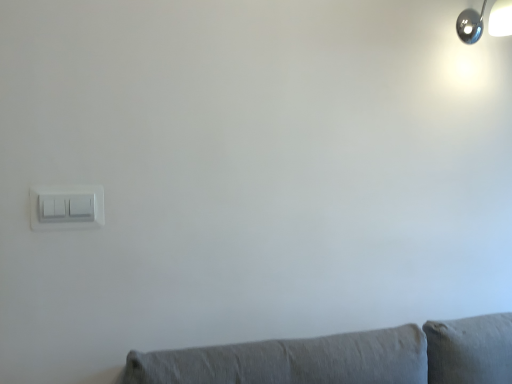
Question: From a real-world perspective, is white plastic light switch at left physically located above or below polished chrome lamp at upper right?

Choices:
 (A) below
 (B) above

Answer: (A)

Question: In terms of size, does white plastic light switch at left appear bigger or smaller than polished chrome lamp at upper right?

Choices:
 (A) big
 (B) small

Answer: (B)

Question: From the image's perspective, is white plastic light switch at left above or below polished chrome lamp at upper right?

Choices:
 (A) below
 (B) above

Answer: (A)

Question: From the image's perspective, relative to white plastic light switch at left, is polished chrome lamp at upper right above or below?

Choices:
 (A) above
 (B) below

Answer: (A)

Question: Is polished chrome lamp at upper right in front of or behind white plastic light switch at left in the image?

Choices:
 (A) behind
 (B) front

Answer: (A)

Question: Is point click(480, 34) positioned closer to the camera than point click(94, 210)?

Choices:
 (A) farther
 (B) closer

Answer: (A)

Question: Considering the positions of polished chrome lamp at upper right and white plastic light switch at left in the image, is polished chrome lamp at upper right bigger or smaller than white plastic light switch at left?

Choices:
 (A) big
 (B) small

Answer: (A)